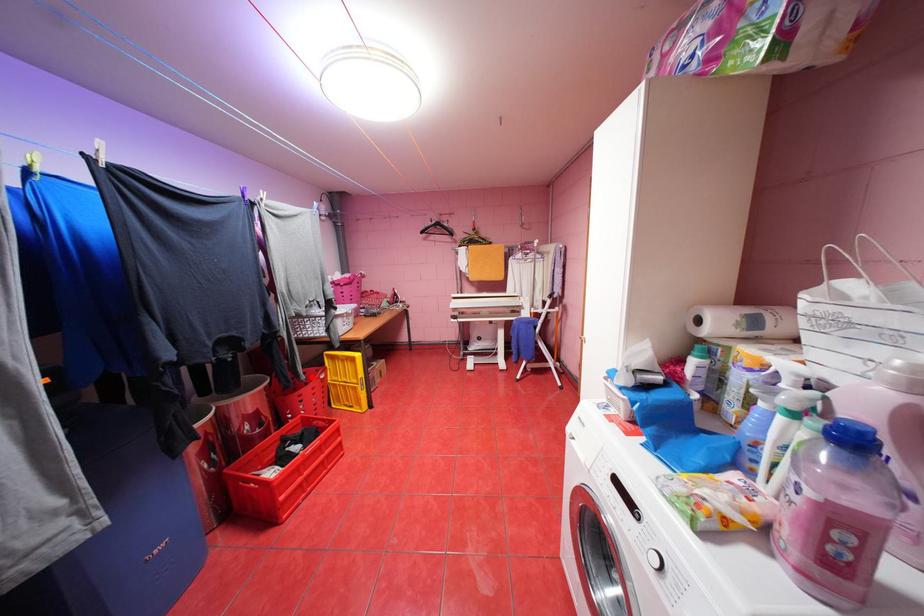
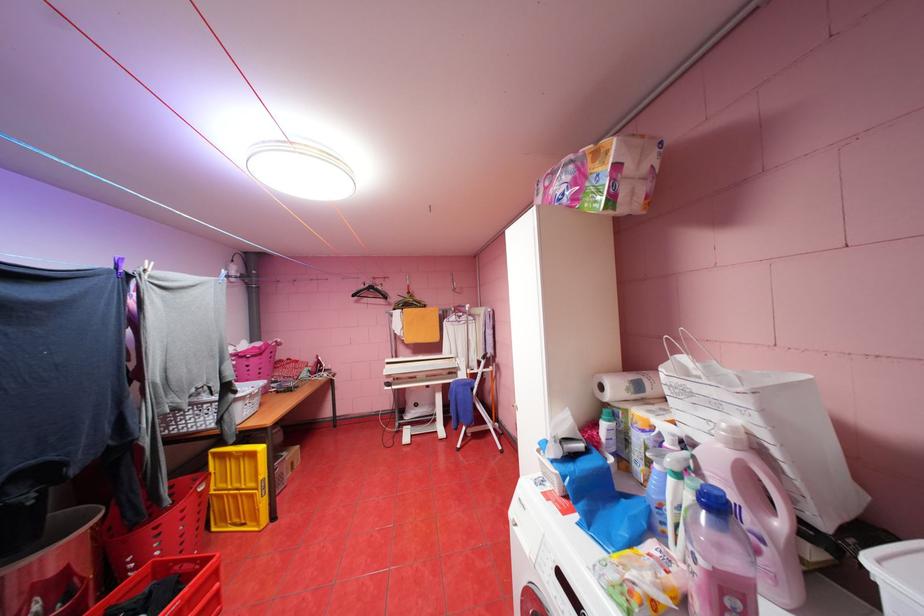
Question: I am providing you with two images of the same scene from different viewpoints. In image1, a red point is highlighted. Considering the same 3D point in image2, which of the following is correct?

Choices:
 (A) It is closer
 (B) It is farther

Answer: (B)